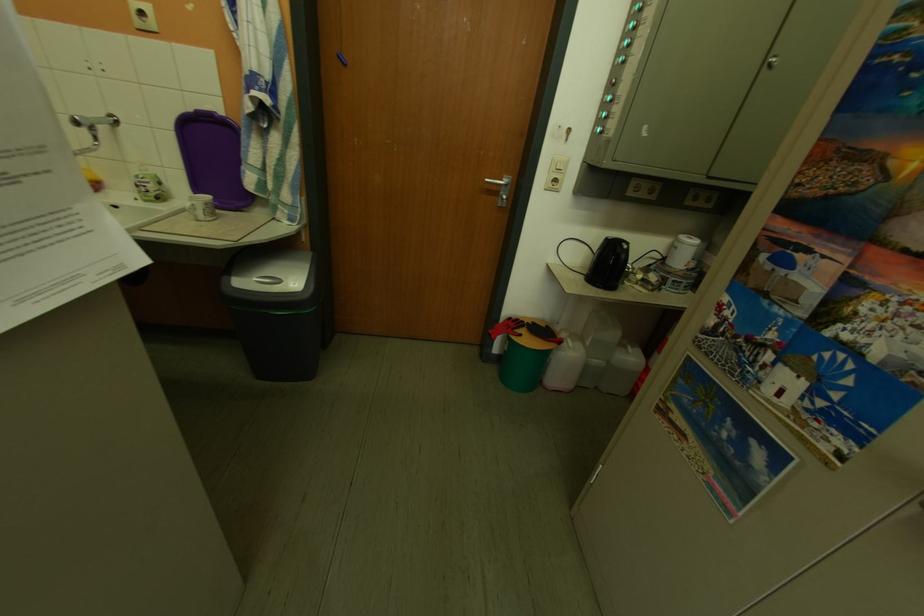
At what (x,y) coordinates should I click in order to perform the action: click on silver door handle. Please return your answer as a coordinate pair (x, y). The image size is (924, 616). Looking at the image, I should click on (500, 182).